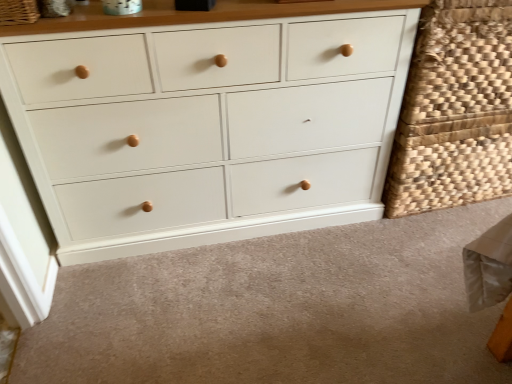
Question: Does white matte drawer at lower center have a greater height compared to woven natural fiber basket at upper left, positioned as the 2th basket in right-to-left order?

Choices:
 (A) no
 (B) yes

Answer: (A)

Question: Is woven natural fiber basket at upper left, marked as the 1th basket in a left-to-right arrangement, surrounded by white matte drawer at lower center?

Choices:
 (A) yes
 (B) no

Answer: (B)

Question: Is white matte drawer at lower center wider than woven natural fiber basket at upper left, positioned as the 1th basket in front-to-back order?

Choices:
 (A) no
 (B) yes

Answer: (B)

Question: Would you consider white matte drawer at lower center to be distant from woven natural fiber basket at upper left, positioned as the 2th basket in right-to-left order?

Choices:
 (A) no
 (B) yes

Answer: (B)

Question: Does white matte drawer at lower center lie behind woven natural fiber basket at upper left, marked as the 1th basket in a left-to-right arrangement?

Choices:
 (A) no
 (B) yes

Answer: (A)

Question: Does white matte drawer at lower center turn towards woven natural fiber basket at upper left, acting as the 2th basket starting from the back?

Choices:
 (A) yes
 (B) no

Answer: (B)

Question: Is white painted wood chest of drawers at center further to the viewer compared to woven natural basket at right, marked as the second basket in a left-to-right arrangement?

Choices:
 (A) no
 (B) yes

Answer: (A)

Question: Is woven natural basket at right, marked as the 1th basket in a right-to-left arrangement, completely or partially inside white painted wood chest of drawers at center?

Choices:
 (A) no
 (B) yes

Answer: (A)

Question: Is white painted wood chest of drawers at center wider than woven natural basket at right, marked as the second basket in a left-to-right arrangement?

Choices:
 (A) no
 (B) yes

Answer: (B)

Question: Is white painted wood chest of drawers at center at the right side of woven natural basket at right, marked as the second basket in a left-to-right arrangement?

Choices:
 (A) no
 (B) yes

Answer: (A)

Question: Does white painted wood chest of drawers at center appear on the left side of woven natural basket at right, marked as the 1th basket in a right-to-left arrangement?

Choices:
 (A) no
 (B) yes

Answer: (B)

Question: Is white painted wood chest of drawers at center facing towards woven natural basket at right, which is counted as the second basket, starting from the front?

Choices:
 (A) no
 (B) yes

Answer: (A)

Question: Is white matte drawer at lower center thinner than white painted wood chest of drawers at center?

Choices:
 (A) no
 (B) yes

Answer: (A)